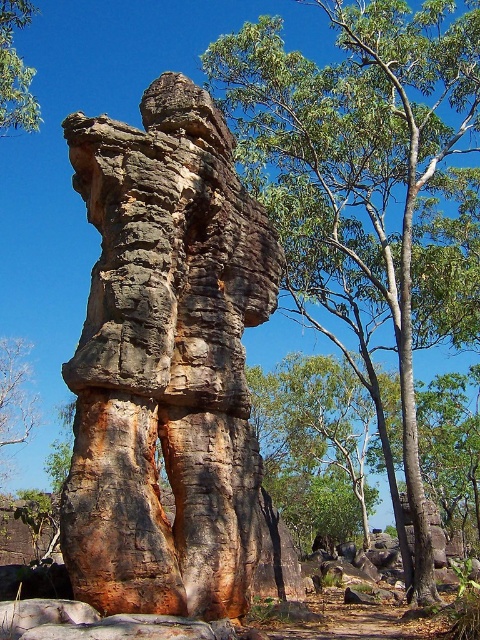
Question: Which object appears closest to the camera in this image?

Choices:
 (A) rustic stone sculpture at center
 (B) green leafy tree at center
 (C) green leafy tree at upper left

Answer: (A)

Question: Does green leafy tree at center have a larger size compared to green leafy tree at upper left?

Choices:
 (A) no
 (B) yes

Answer: (B)

Question: Is rustic stone sculpture at center in front of green leafy tree at center?

Choices:
 (A) yes
 (B) no

Answer: (A)

Question: Does green leafy tree at center appear on the right side of green leafy tree at upper left?

Choices:
 (A) yes
 (B) no

Answer: (A)

Question: Which point appears closest to the camera in this image?

Choices:
 (A) (32, 6)
 (B) (110, 496)
 (C) (240, 116)

Answer: (B)

Question: Among these points, which one is farthest from the camera?

Choices:
 (A) (7, 108)
 (B) (123, 349)

Answer: (A)